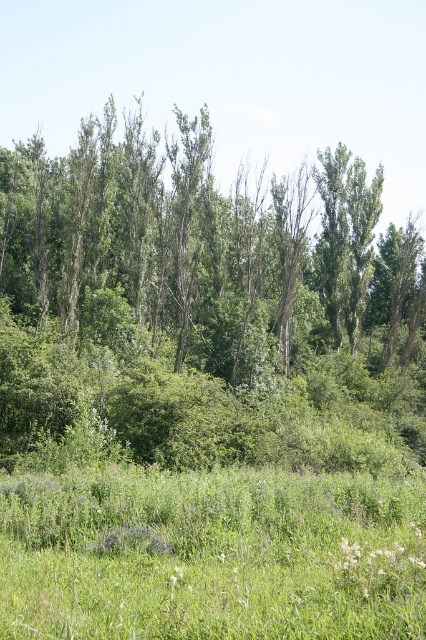
Does green grassy field at lower center come behind green leafy tree at upper center?

No, green grassy field at lower center is closer to the viewer.

In order to click on green grassy field at lower center in this screenshot , I will do `click(212, 556)`.

Can you confirm if green leafy forest at center is positioned to the left of green grassy field at lower center?

Correct, you'll find green leafy forest at center to the left of green grassy field at lower center.

Can you confirm if green leafy forest at center is smaller than green grassy field at lower center?

Actually, green leafy forest at center might be larger than green grassy field at lower center.

Is point (345, 253) farther from viewer compared to point (385, 525)?

Yes, point (345, 253) is behind point (385, 525).

Locate an element on the screen. Image resolution: width=426 pixels, height=640 pixels. green leafy forest at center is located at coordinates (206, 305).

Does green leafy forest at center have a smaller size compared to green leafy tree at upper center?

Actually, green leafy forest at center might be larger than green leafy tree at upper center.

Which is more to the right, green leafy forest at center or green leafy tree at upper center?

green leafy tree at upper center is more to the right.

Does point (423, 419) come closer to viewer compared to point (333, 243)?

Yes, it is in front of point (333, 243).

Where is `green leafy forest at center`? The image size is (426, 640). green leafy forest at center is located at coordinates (206, 305).